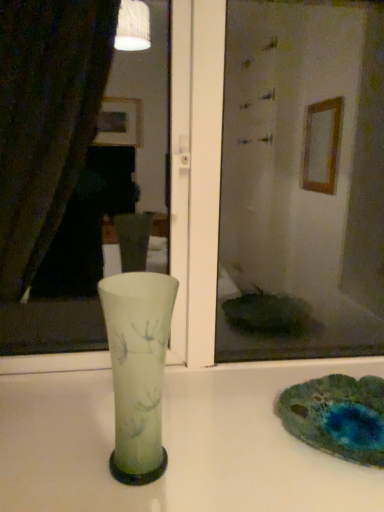
Question: Is transparent glass mirror at center oriented away from white glossy vase at center?

Choices:
 (A) no
 (B) yes

Answer: (A)

Question: Is transparent glass mirror at center closer to camera compared to white glossy vase at center?

Choices:
 (A) yes
 (B) no

Answer: (B)

Question: Would you say transparent glass mirror at center is a long distance from white glossy vase at center?

Choices:
 (A) no
 (B) yes

Answer: (A)

Question: From the image's perspective, is transparent glass mirror at center above white glossy vase at center?

Choices:
 (A) yes
 (B) no

Answer: (A)

Question: Can you confirm if transparent glass mirror at center is smaller than white glossy vase at center?

Choices:
 (A) no
 (B) yes

Answer: (A)

Question: Does transparent glass mirror at center turn towards white glossy vase at center?

Choices:
 (A) no
 (B) yes

Answer: (A)

Question: From a real-world perspective, is white glossy vase at center over frosted glass vase at center?

Choices:
 (A) no
 (B) yes

Answer: (A)

Question: Is white glossy vase at center turned away from frosted glass vase at center?

Choices:
 (A) no
 (B) yes

Answer: (A)

Question: Is white glossy vase at center closer to the viewer compared to frosted glass vase at center?

Choices:
 (A) no
 (B) yes

Answer: (B)

Question: Does white glossy vase at center have a smaller size compared to frosted glass vase at center?

Choices:
 (A) no
 (B) yes

Answer: (A)

Question: Is frosted glass vase at center inside white glossy vase at center?

Choices:
 (A) yes
 (B) no

Answer: (B)

Question: Could you tell me if white glossy vase at center is turned towards frosted glass vase at center?

Choices:
 (A) yes
 (B) no

Answer: (B)

Question: Is transparent glass mirror at center not close to frosted glass vase at center?

Choices:
 (A) yes
 (B) no

Answer: (B)